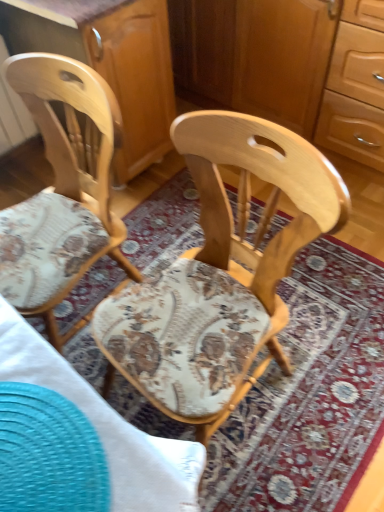
Question: Is wooden cabinet at center at the left side of wooden dresser at center?

Choices:
 (A) yes
 (B) no

Answer: (A)

Question: Is wooden cabinet at center thinner than wooden dresser at center?

Choices:
 (A) yes
 (B) no

Answer: (A)

Question: Can we say wooden cabinet at center lies outside wooden dresser at center?

Choices:
 (A) yes
 (B) no

Answer: (A)

Question: Is wooden cabinet at center directly adjacent to wooden dresser at center?

Choices:
 (A) yes
 (B) no

Answer: (B)

Question: From a real-world perspective, is wooden cabinet at center on top of wooden dresser at center?

Choices:
 (A) yes
 (B) no

Answer: (A)

Question: Visually, is natural wood chair at left, placed as the second chair when sorted from right to left, positioned to the left or to the right of natural wood chair at center, which is counted as the 1th chair, starting from the right?

Choices:
 (A) left
 (B) right

Answer: (A)

Question: Is natural wood chair at left, placed as the second chair when sorted from right to left, spatially inside natural wood chair at center, which appears as the 2th chair when viewed from the left, or outside of it?

Choices:
 (A) inside
 (B) outside

Answer: (B)

Question: Looking at their shapes, would you say natural wood chair at left, arranged as the 1th chair when viewed from the left, is wider or thinner than natural wood chair at center, which is counted as the 1th chair, starting from the right?

Choices:
 (A) wide
 (B) thin

Answer: (B)

Question: Is natural wood chair at left, placed as the second chair when sorted from right to left, taller or shorter than natural wood chair at center, which is counted as the 1th chair, starting from the right?

Choices:
 (A) tall
 (B) short

Answer: (B)

Question: From the image's perspective, is wooden cabinet at center positioned above or below wooden dresser at center?

Choices:
 (A) below
 (B) above

Answer: (A)

Question: Looking at their shapes, would you say wooden cabinet at center is wider or thinner than wooden dresser at center?

Choices:
 (A) wide
 (B) thin

Answer: (B)

Question: Is wooden cabinet at center inside the boundaries of wooden dresser at center, or outside?

Choices:
 (A) inside
 (B) outside

Answer: (B)

Question: From their relative heights in the image, would you say wooden cabinet at center is taller or shorter than wooden dresser at center?

Choices:
 (A) short
 (B) tall

Answer: (B)

Question: Is point (89, 84) positioned closer to the camera than point (130, 162)?

Choices:
 (A) closer
 (B) farther

Answer: (A)

Question: Considering the positions of natural wood chair at left, placed as the second chair when sorted from right to left, and wooden dresser at center in the image, is natural wood chair at left, placed as the second chair when sorted from right to left, wider or thinner than wooden dresser at center?

Choices:
 (A) thin
 (B) wide

Answer: (A)